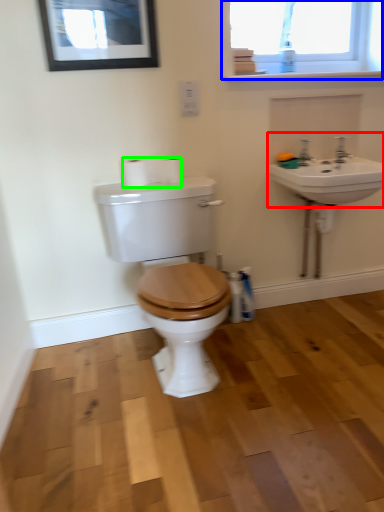
Question: Estimate the real-world distances between objects in this image. Which object is farther from sink (highlighted by a red box), window (highlighted by a blue box) or toilet paper (highlighted by a green box)?

Choices:
 (A) window
 (B) toilet paper

Answer: (B)